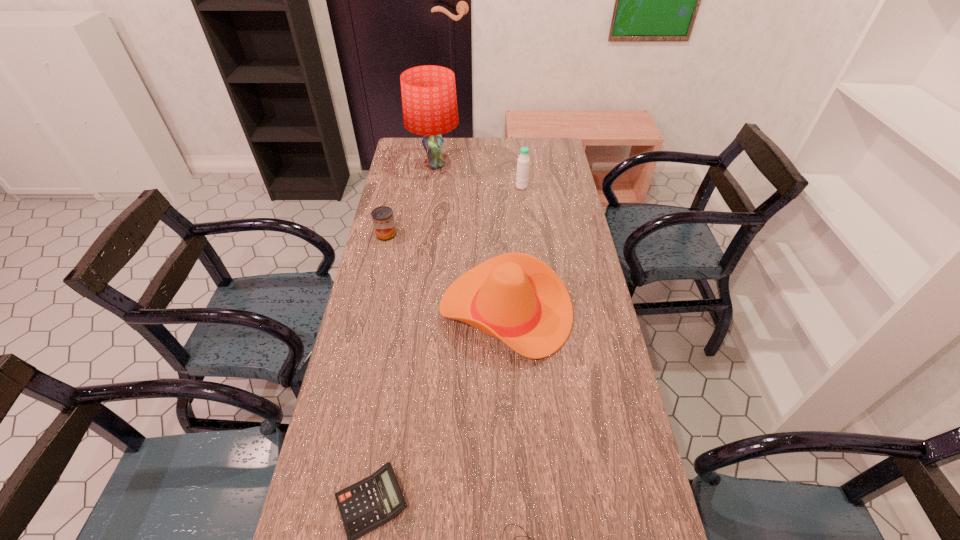
Locate an element on the screen. lampshade is located at coordinates (429, 102).

Locate an element on the screen. This screenshot has width=960, height=540. the tallest object is located at coordinates (429, 102).

Locate an element on the screen. water bottle is located at coordinates (523, 160).

What are the coordinates of `cowboy hat` in the screenshot? It's located at (515, 297).

Locate an element on the screen. The image size is (960, 540). can is located at coordinates (383, 220).

Where is `the fourth nearest object`? the fourth nearest object is located at coordinates pos(383,220).

Locate an element on the screen. The width and height of the screenshot is (960, 540). free region located on the front-facing side of the tallest object is located at coordinates (429, 206).

I want to click on free region located 0.130m on the left of the second farthest object, so click(x=485, y=187).

This screenshot has height=540, width=960. Identify the location of vacant space situated 0.090m on the left of the cowboy hat. (411, 311).

Where is `vacant space located on the right of the can`? vacant space located on the right of the can is located at coordinates click(444, 234).